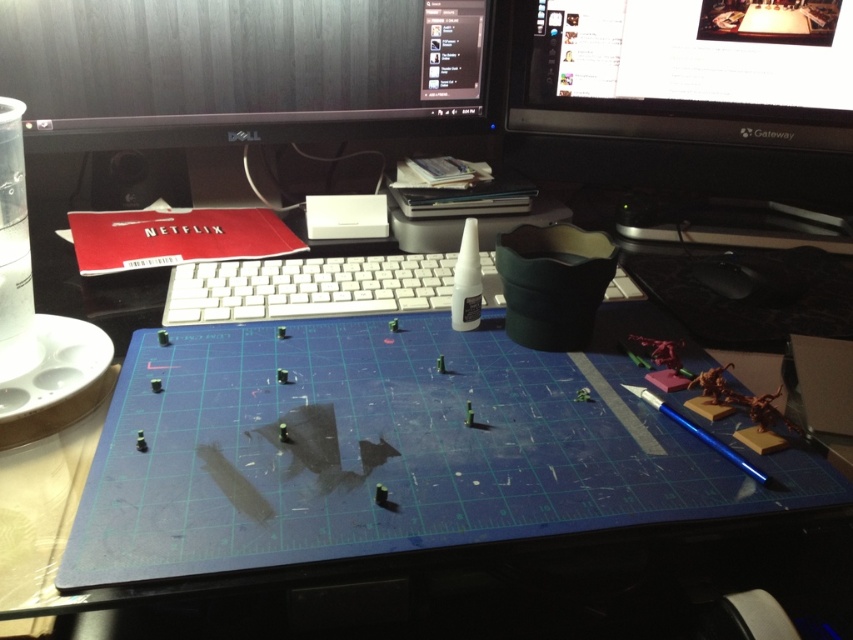
The height and width of the screenshot is (640, 853). What do you see at coordinates (245, 68) in the screenshot?
I see `black plastic monitor at upper center` at bounding box center [245, 68].

Is black plastic monitor at upper center positioned behind black glossy gateway monitor at upper right?

No, black plastic monitor at upper center is in front of black glossy gateway monitor at upper right.

Locate an element on the screen. black plastic monitor at upper center is located at coordinates (245, 68).

Between black glossy gateway monitor at upper right and white plastic keyboard at center, which one has more height?

A: Standing taller between the two is black glossy gateway monitor at upper right.

Which is in front, point (634, 76) or point (393, 256)?

Point (393, 256) is in front.

The image size is (853, 640). In order to click on black glossy gateway monitor at upper right in this screenshot , I will do `click(686, 72)`.

Who is positioned more to the left, blue cutting mat at center or black glossy gateway monitor at upper right?

From the viewer's perspective, blue cutting mat at center appears more on the left side.

Who is lower down, blue cutting mat at center or black glossy gateway monitor at upper right?

blue cutting mat at center is lower down.

Does point (444, 324) lie in front of point (786, 48)?

Yes, it is.

This screenshot has width=853, height=640. Identify the location of blue cutting mat at center. (498, 580).